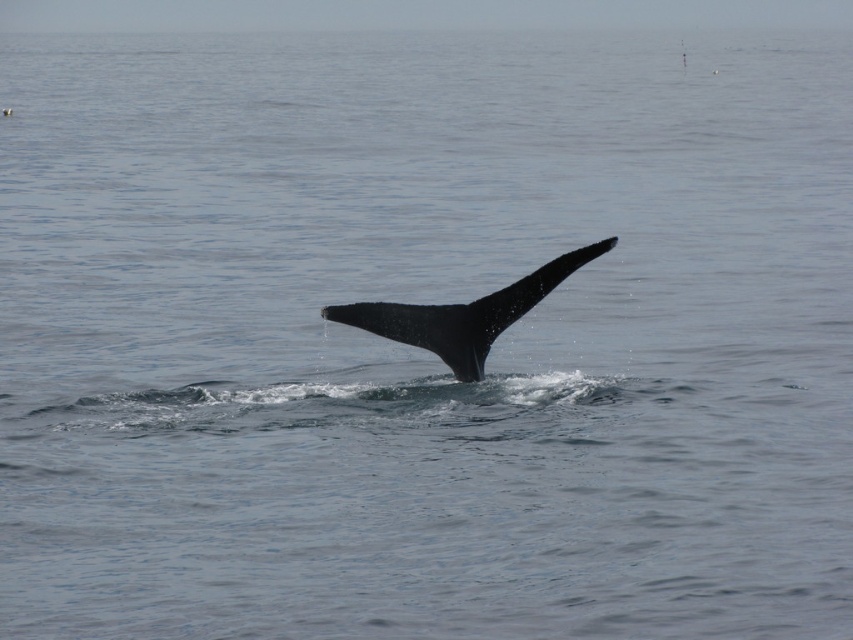
You are a marine biologist observing the ocean surface. You notice two black shapes at the center of the water. Which one is positioned to the left when looking at the black matte whale tail at center and the black smooth fin at center?

The black matte whale tail at center is positioned to the left of the black smooth fin at center.

You are a marine biologist observing the ocean surface from a boat anchored 15 meters away from the black matte whale tail at center. Can you confirm if the tail is within your visible range?

The black matte whale tail at center is 10.38 meters away from the camera, so yes, it is within your visible range as the boat is anchored 15 meters away.